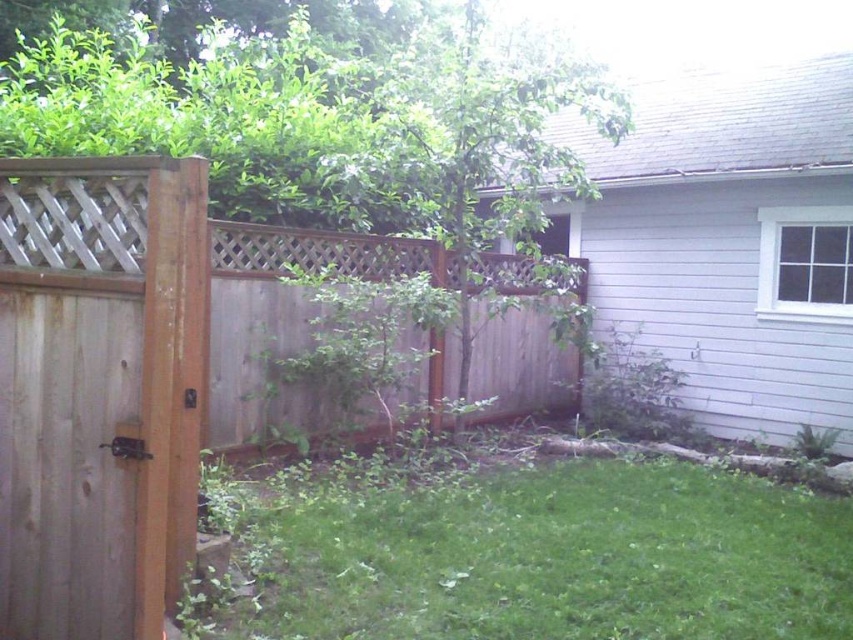
Is green grass at lower center below brown wood gate at left?

Indeed, green grass at lower center is positioned under brown wood gate at left.

Identify the location of green grass at lower center. (540, 556).

Who is more forward, (373, 477) or (119, 545)?

Point (119, 545) is more forward.

Identify the location of green grass at lower center. (540, 556).

Between green grass at lower center and brown wood fence at left, which one has less height?

With less height is green grass at lower center.

Is the position of green grass at lower center more distant than that of brown wood fence at left?

That is False.

Between point (256, 508) and point (521, 388), which one is positioned behind?

The point (521, 388) is more distant.

Locate an element on the screen. green grass at lower center is located at coordinates (540, 556).

From the picture: Does brown wood gate at left have a lesser width compared to brown wood fence at left?

No.

Between brown wood gate at left and brown wood fence at left, which one is positioned higher?

brown wood fence at left is above.

Does point (111, 326) come in front of point (506, 272)?

Yes, it is.

What are the coordinates of `brown wood gate at left` in the screenshot? It's located at (100, 390).